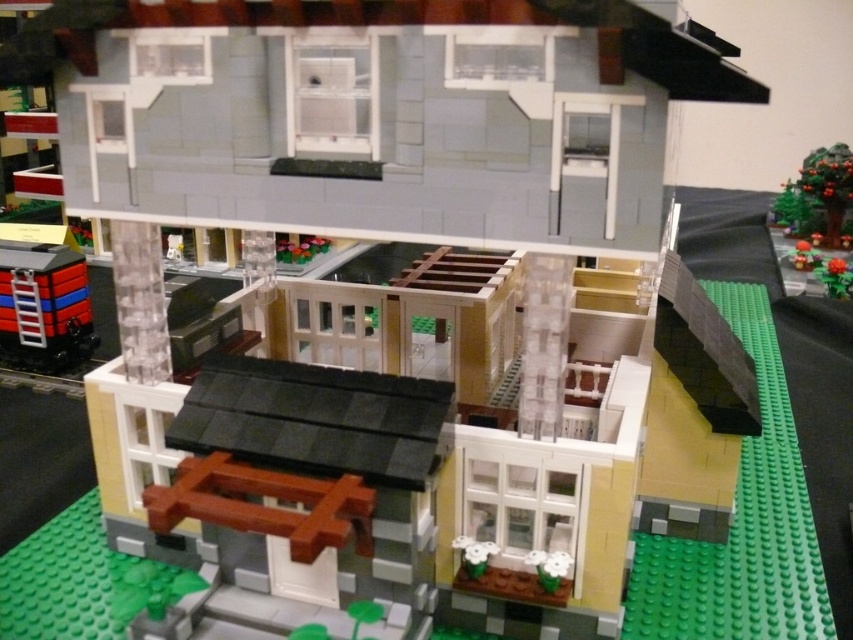
I want to click on matte black train at left, so click(44, 307).

How far apart are matte black train at left and green matte tree at upper right?

matte black train at left is 6.59 feet from green matte tree at upper right.

Between point (0, 307) and point (807, 161), which one is positioned behind?

The point (807, 161) is behind.

Find the location of a particular element. The width and height of the screenshot is (853, 640). matte black train at left is located at coordinates (44, 307).